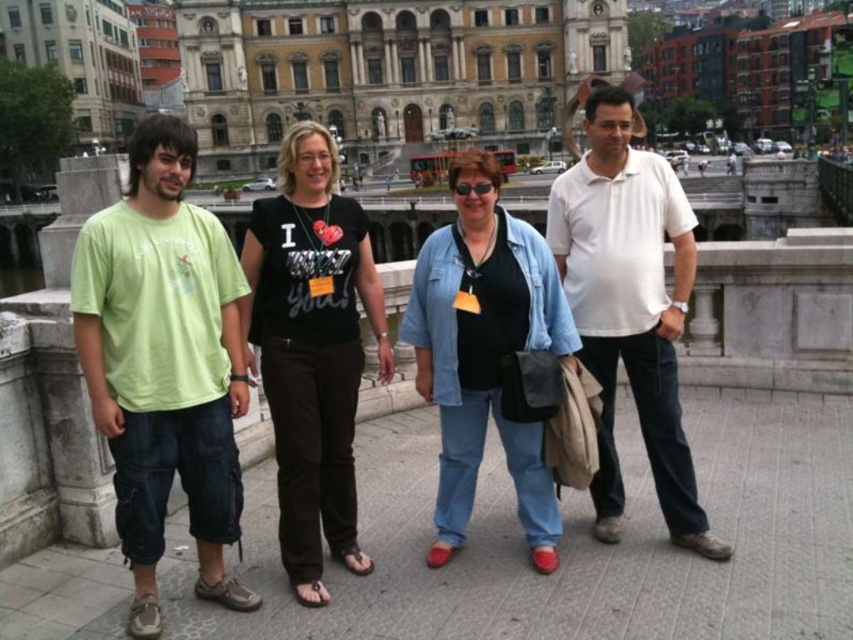
Question: Which point is farther to the camera?

Choices:
 (A) denim jacket at center
 (B) black cotton t-shirt at center
 (C) white cotton polo shirt at center

Answer: (A)

Question: Which point appears closest to the camera in this image?

Choices:
 (A) (628, 164)
 (B) (491, 266)

Answer: (B)

Question: Does black cotton t-shirt at center lie in front of denim jacket at center?

Choices:
 (A) yes
 (B) no

Answer: (A)

Question: Is black cotton t-shirt at center closer to camera compared to denim jacket at center?

Choices:
 (A) no
 (B) yes

Answer: (B)

Question: Can you confirm if black cotton t-shirt at center is positioned to the left of white cotton polo shirt at center?

Choices:
 (A) no
 (B) yes

Answer: (B)

Question: Which object is the farthest from the denim jacket at center?

Choices:
 (A) green cotton t-shirt at left
 (B) white cotton polo shirt at center

Answer: (A)